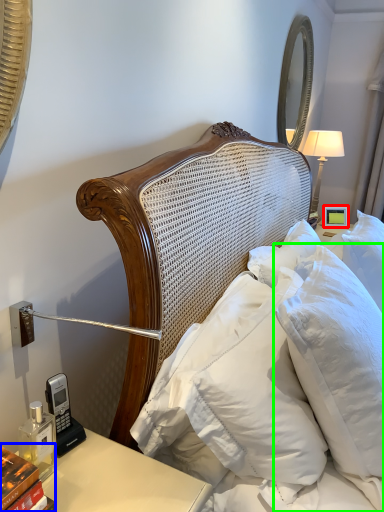
Question: Estimate the real-world distances between objects in this image. Which object is closer to picture frame (highlighted by a red box), book (highlighted by a blue box) or pillow (highlighted by a green box)?

Choices:
 (A) book
 (B) pillow

Answer: (B)